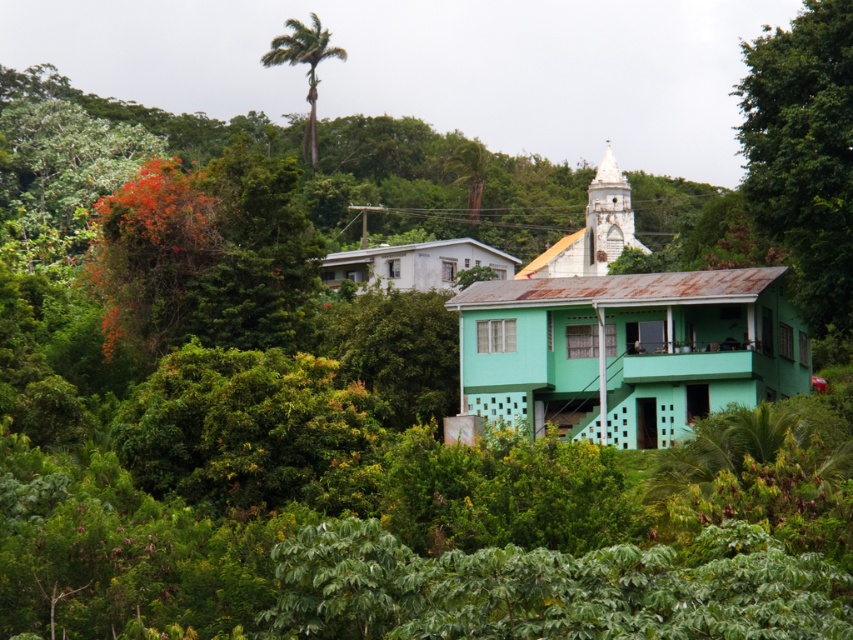
You are standing at the entrance of the turquoise house with a rusted metal roof and want to find the white matte church at center. Based on your current position, in which direction should you walk to reach it?

Since the white matte church at center is located at coordinates approximately 0.527 on the x axis and 0.732 on the y axis, you should walk forward and slightly to the right from the entrance of the turquoise house with a rusted metal roof to reach it.

You are a visitor standing in front of the turquoise house with a rusted metal roof. You want to take a photo of the white matte church at center and the green leafy palm tree at upper center. Which object should you point your camera towards first to capture both in the frame?

The white matte church at center is located below the green leafy palm tree at upper center, so you should point your camera towards the green leafy palm tree at upper center first to ensure both are in the frame.

You are a drone operator trying to capture aerial footage of the white matte church at center and the green leafy palm tree at upper center. Based on their sizes in the image, which one would appear larger in your camera view?

The green leafy palm tree at upper center appears larger in the camera view because it is bigger than the white matte church at center according to the description.